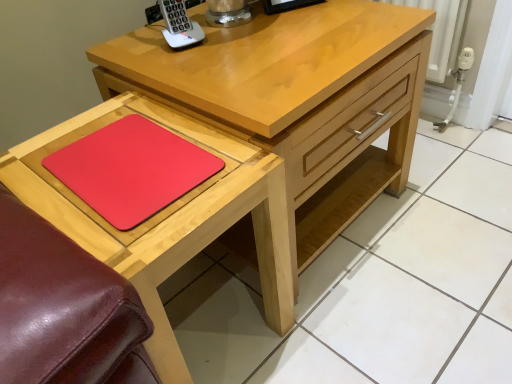
Where is `free spot above rubberized red mousepad at lower left (from a real-world perspective)`? The width and height of the screenshot is (512, 384). free spot above rubberized red mousepad at lower left (from a real-world perspective) is located at coordinates (128, 154).